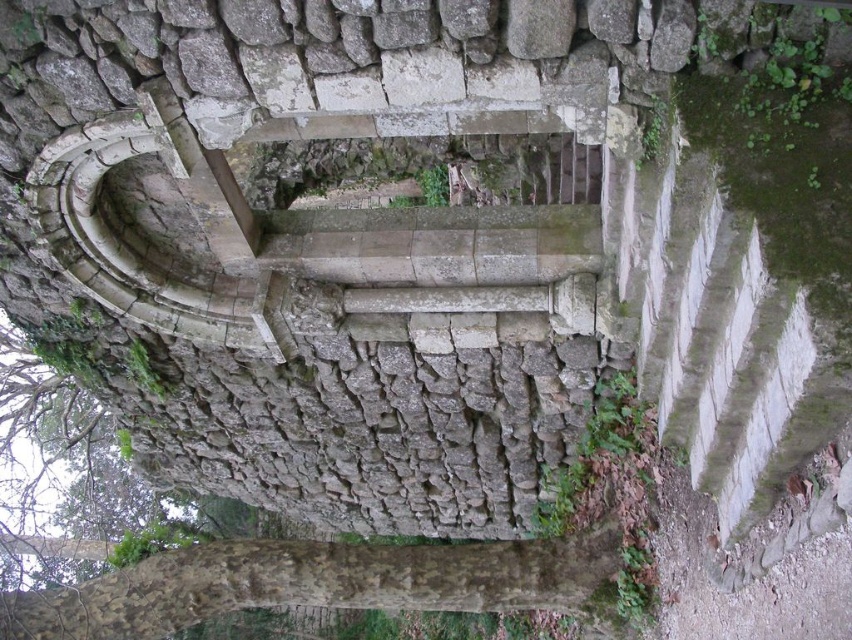
Is point (597, 589) positioned before point (239, 548)?

No, (597, 589) is further to viewer.

What do you see at coordinates (315, 582) in the screenshot? I see `brown rough bark at lower left` at bounding box center [315, 582].

Locate an element on the screen. brown rough bark at lower left is located at coordinates (315, 582).